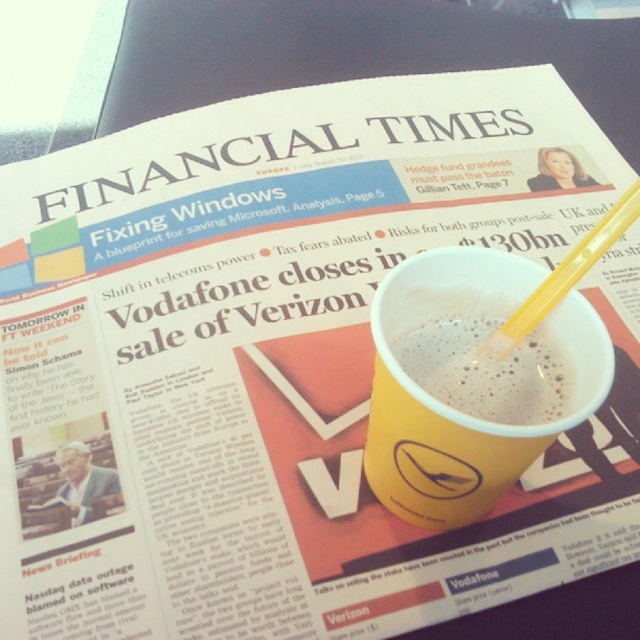
Between white frothy coffee at center and yellow plastic straw at upper right, which one has more height?

yellow plastic straw at upper right

In the scene shown: Can you confirm if white frothy coffee at center is wider than yellow plastic straw at upper right?

Indeed, white frothy coffee at center has a greater width compared to yellow plastic straw at upper right.

Image resolution: width=640 pixels, height=640 pixels. I want to click on white frothy coffee at center, so click(x=484, y=369).

Does yellow paper cup at center have a lesser width compared to white frothy coffee at center?

No.

Find the location of `yellow paper cup at center`. yellow paper cup at center is located at coordinates (456, 408).

Find the location of a particular element. yellow paper cup at center is located at coordinates (456, 408).

The image size is (640, 640). I want to click on yellow paper cup at center, so click(x=456, y=408).

Can you confirm if yellow paper cup at center is thinner than yellow plastic straw at upper right?

No, yellow paper cup at center is not thinner than yellow plastic straw at upper right.

Between yellow paper cup at center and yellow plastic straw at upper right, which one is positioned higher?

Positioned higher is yellow plastic straw at upper right.

Who is more forward, (531, 433) or (580, 250)?

Point (531, 433)

Identify the location of yellow paper cup at center. (456, 408).